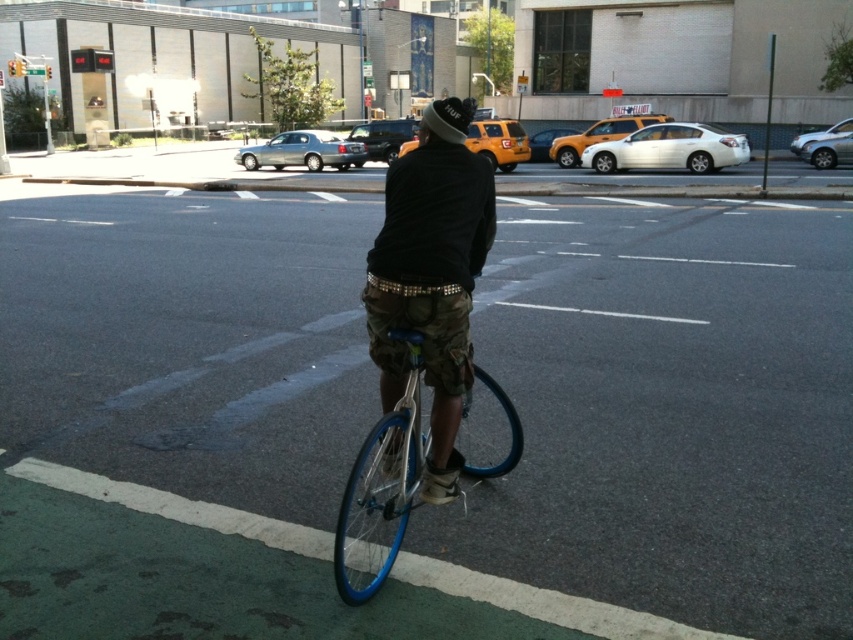
Question: Does camouflage shorts at center appear under blue metallic bicycle at center?

Choices:
 (A) yes
 (B) no

Answer: (B)

Question: Among these points, which one is nearest to the camera?

Choices:
 (A) [x=276, y=250]
 (B) [x=415, y=400]
 (C) [x=492, y=186]

Answer: (B)

Question: Which point is farther to the camera?

Choices:
 (A) (49, 298)
 (B) (444, 442)

Answer: (A)

Question: Does green asphalt bike lane at center have a larger size compared to camouflage shorts at center?

Choices:
 (A) yes
 (B) no

Answer: (A)

Question: Does camouflage shorts at center appear under blue metallic bicycle at center?

Choices:
 (A) yes
 (B) no

Answer: (B)

Question: Which of the following is the farthest from the observer?

Choices:
 (A) (453, 380)
 (B) (537, 308)
 (C) (393, 436)

Answer: (B)